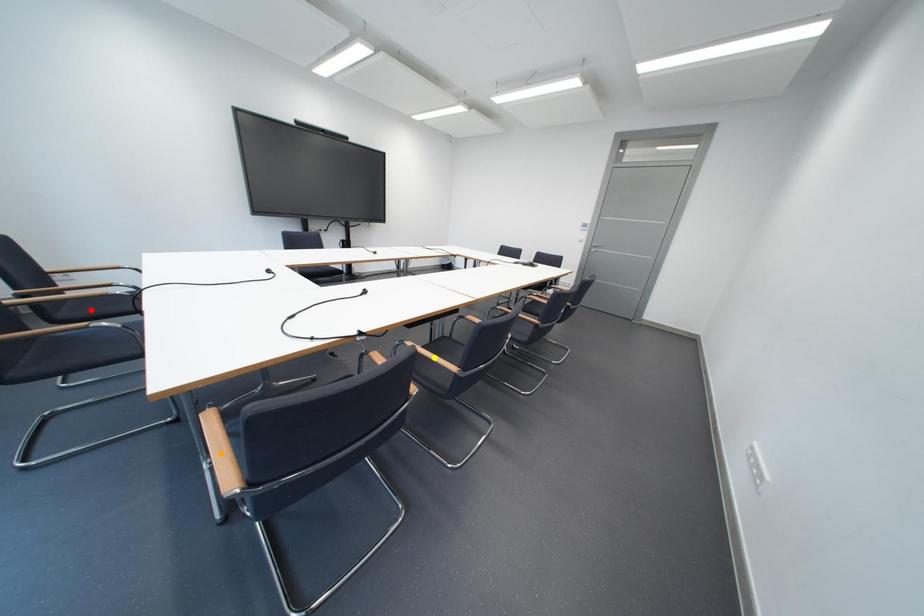
Order these from nearest to farthest:
A) orange point
B) yellow point
C) red point

orange point < red point < yellow point